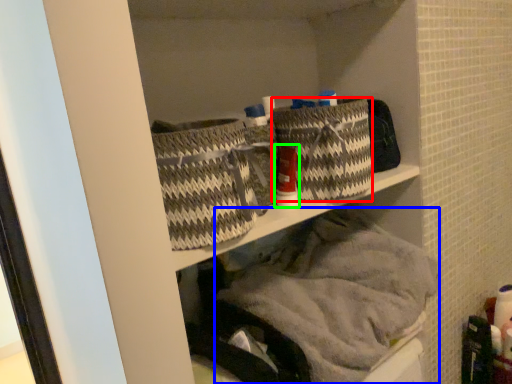
Question: Considering the real-world distances, which object is farthest from basket (highlighted by a red box)? material (highlighted by a blue box) or toiletry (highlighted by a green box)?

Choices:
 (A) material
 (B) toiletry

Answer: (A)